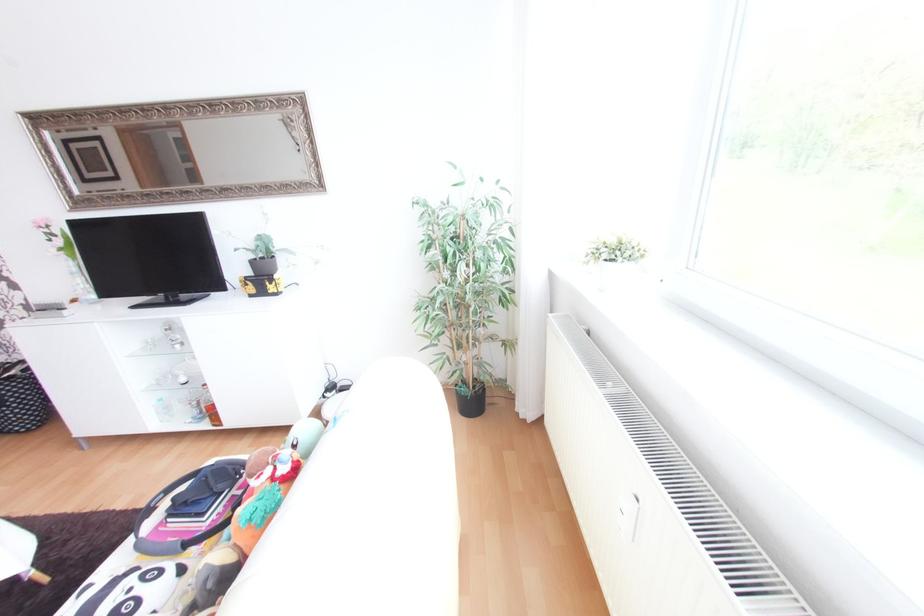
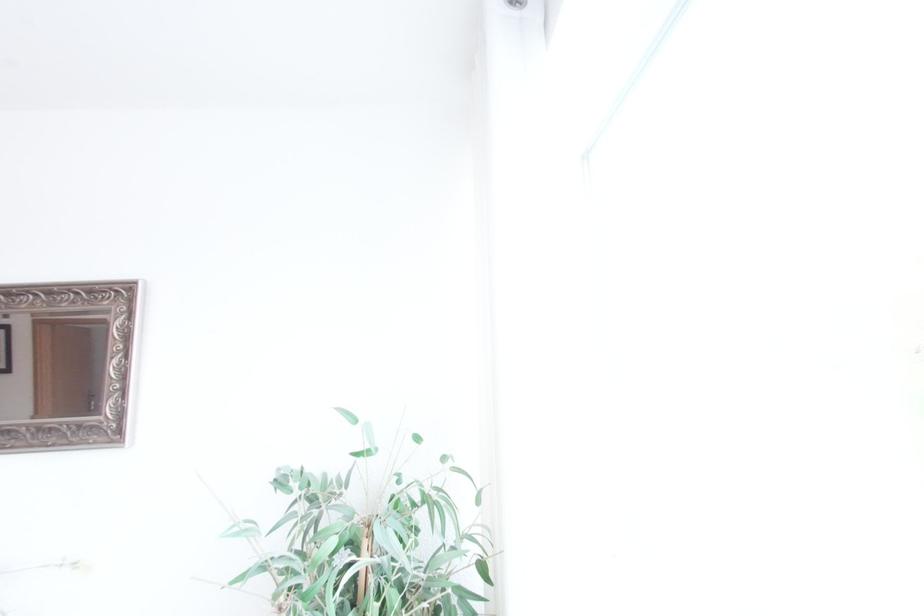
Question: How did the camera likely rotate?

Choices:
 (A) Left
 (B) Right
 (C) Up
 (D) Down

Answer: (C)